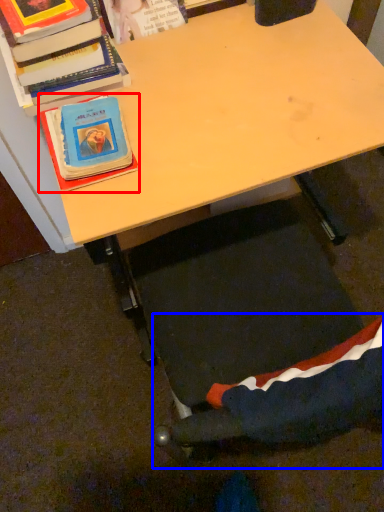
Question: Which point is further to the camera, book (highlighted by a red box) or swivel chair (highlighted by a blue box)?

Choices:
 (A) book
 (B) swivel chair

Answer: (A)